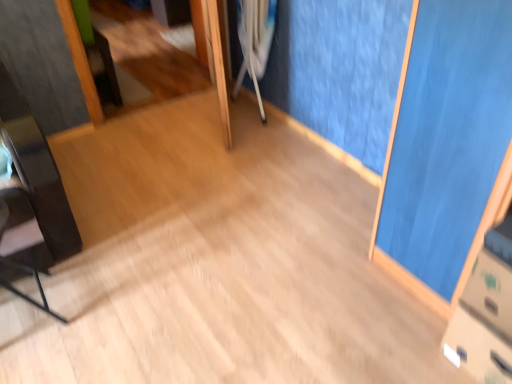
Locate an element on the screen. Image resolution: width=512 pixels, height=384 pixels. free spot below matte black chair at left (from a real-world perspective) is located at coordinates (31, 315).